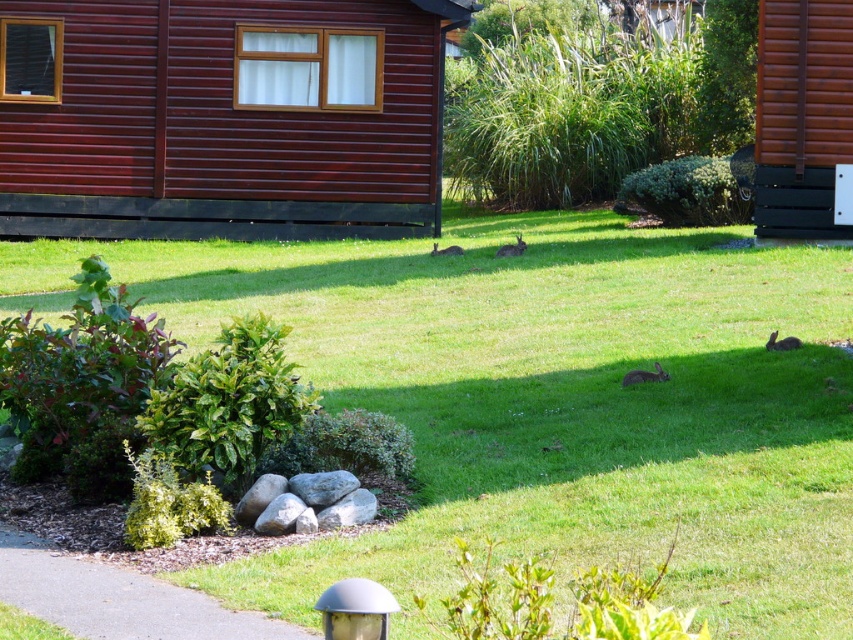
Which of these two, green grass at center or wooden cabin at upper left, stands taller?

green grass at center is taller.

Is green grass at center closer to camera compared to wooden cabin at upper left?

Yes, green grass at center is in front of wooden cabin at upper left.

Describe the element at coordinates (550, 403) in the screenshot. I see `green grass at center` at that location.

Find the location of a particular element. This screenshot has width=853, height=640. green grass at center is located at coordinates (550, 403).

Who is positioned more to the left, green grass at center or brown wooden cabin at right?

green grass at center is more to the left.

Is green grass at center taller than brown wooden cabin at right?

Correct, green grass at center is much taller as brown wooden cabin at right.

Does point (595, 272) come behind point (801, 134)?

No, (595, 272) is closer to viewer.

Image resolution: width=853 pixels, height=640 pixels. What are the coordinates of `green grass at center` in the screenshot? It's located at (550, 403).

Is wooden cabin at upper left below brown wooden cabin at right?

No.

Between wooden cabin at upper left and brown wooden cabin at right, which one appears on the right side from the viewer's perspective?

Positioned to the right is brown wooden cabin at right.

Is point (430, 24) positioned in front of point (804, 45)?

No, it is behind (804, 45).

Image resolution: width=853 pixels, height=640 pixels. What are the coordinates of `wooden cabin at upper left` in the screenshot? It's located at (222, 116).